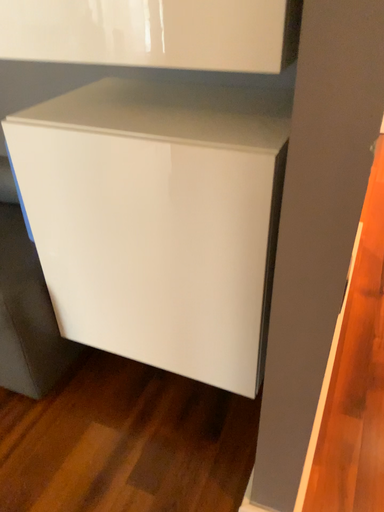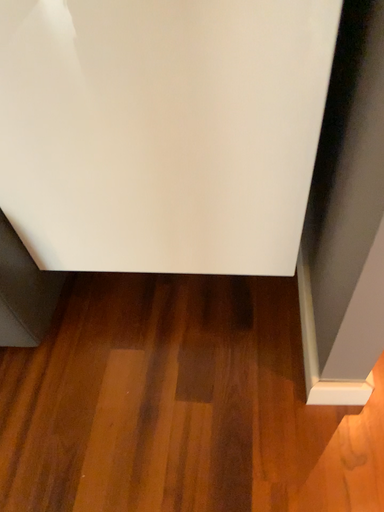
Question: Which way did the camera rotate in the video?

Choices:
 (A) rotated right
 (B) rotated left

Answer: (A)